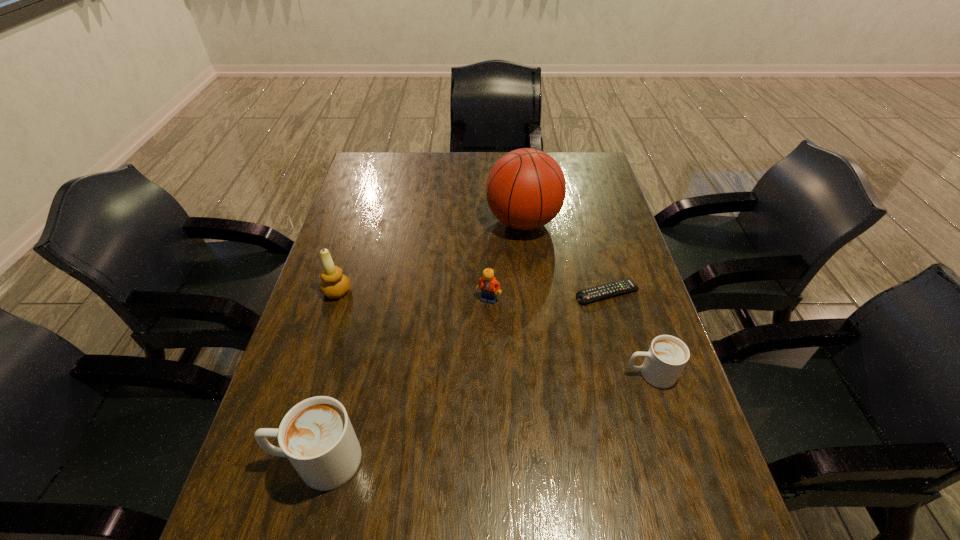
To make them evenly spaced by inserting another cappuccino among them, please locate a vacant spot for this new cappuccino. Please provide its 2D coordinates. Your answer should be formatted as a tuple, i.e. [(x, y)], where the tuple contains the x and y coordinates of a point satisfying the conditions above.

[(496, 414)]